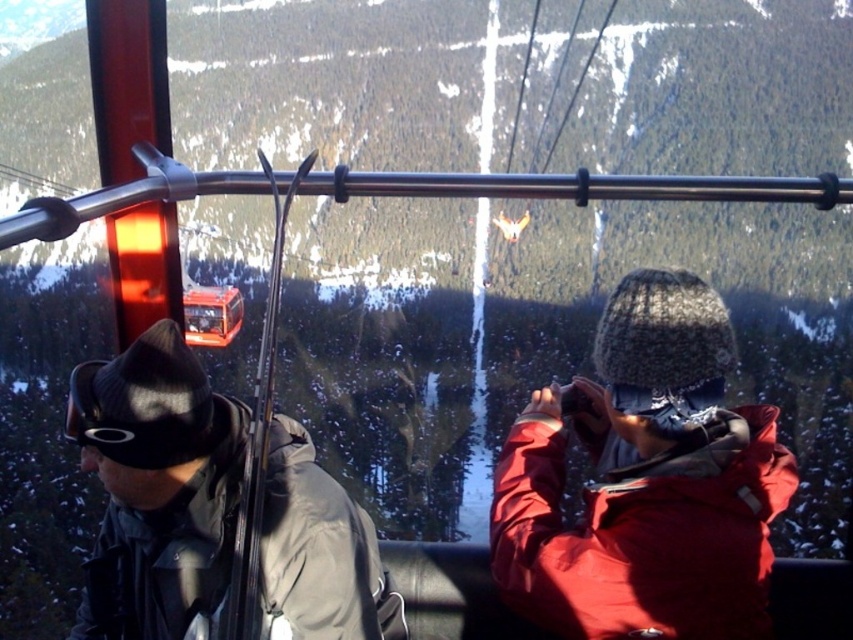
Question: Among these points, which one is farthest from the camera?

Choices:
 (A) [300, 548]
 (B) [215, 580]

Answer: (A)

Question: Which object is farther from the camera taking this photo?

Choices:
 (A) gray matte jacket at left
 (B) matte black jacket at left

Answer: (A)

Question: Can you confirm if matte black jacket at left is positioned above gray matte jacket at left?

Choices:
 (A) yes
 (B) no

Answer: (A)

Question: Does matte black jacket at left lie in front of gray matte jacket at left?

Choices:
 (A) yes
 (B) no

Answer: (A)

Question: Does matte black jacket at left appear on the right side of gray matte jacket at left?

Choices:
 (A) no
 (B) yes

Answer: (B)

Question: Which point is closer to the camera?

Choices:
 (A) (646, 492)
 (B) (144, 577)

Answer: (A)